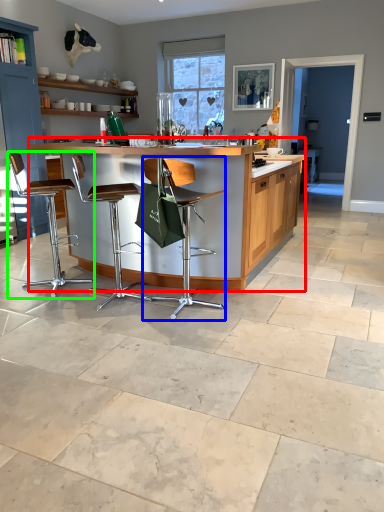
Question: Which object is the farthest from table (highlighted by a red box)? Choose among these: chair (highlighted by a blue box) or chair (highlighted by a green box).

Choices:
 (A) chair
 (B) chair

Answer: (B)